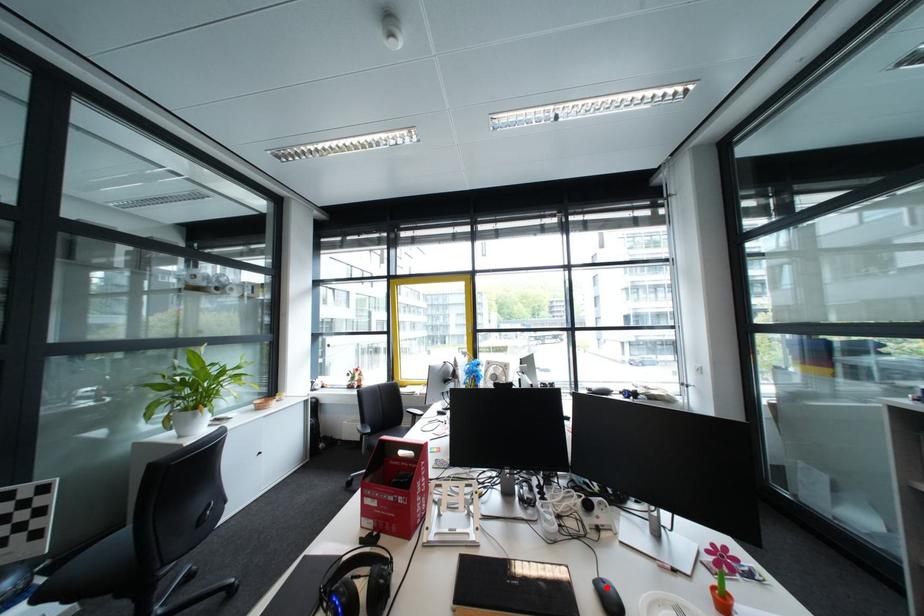
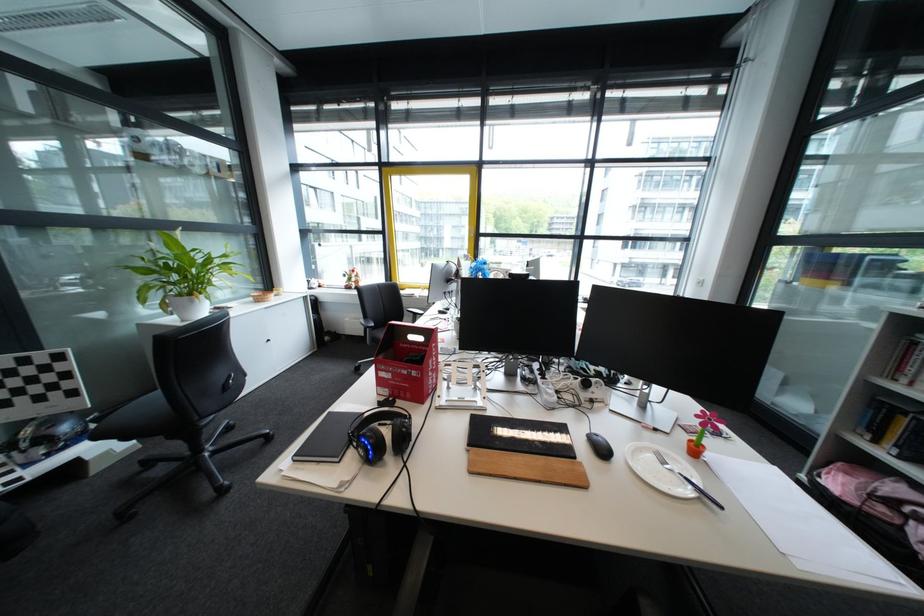
Where in the second image is the point corresponding to the highlighted location from the first image?

(600, 439)